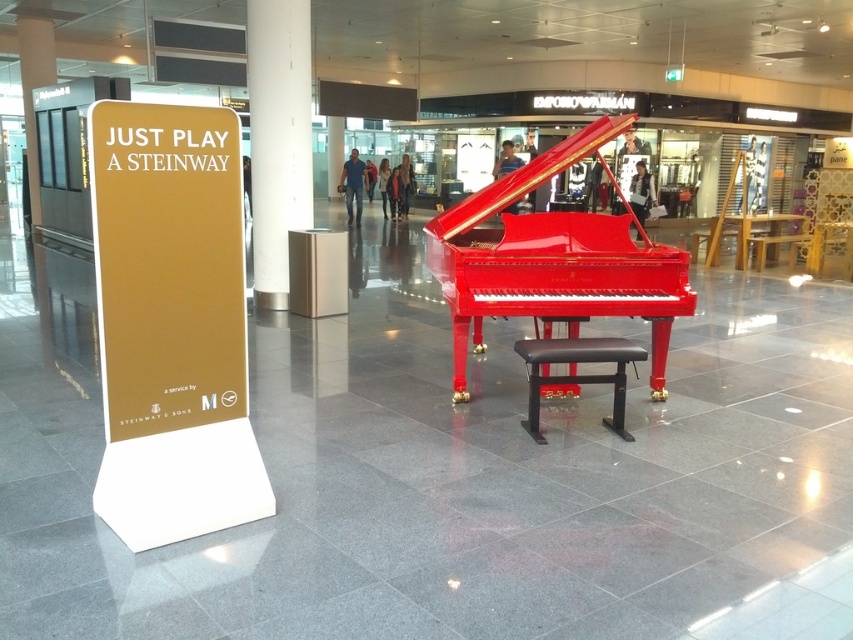
Does metallic gold pillar at upper left appear over metallic gray pillar at center?

No, metallic gold pillar at upper left is not above metallic gray pillar at center.

Does metallic gold pillar at upper left appear under metallic gray pillar at center?

Correct, metallic gold pillar at upper left is located below metallic gray pillar at center.

Who is more distant from viewer, (33, 160) or (334, 173)?

Positioned behind is point (334, 173).

Identify the location of metallic gold pillar at upper left. The width and height of the screenshot is (853, 640). (33, 88).

Can you confirm if white glossy pillar at center is positioned to the right of black leather stool at center?

In fact, white glossy pillar at center is to the left of black leather stool at center.

Describe the element at coordinates (277, 138) in the screenshot. This screenshot has height=640, width=853. I see `white glossy pillar at center` at that location.

Where is `white glossy pillar at center`? The height and width of the screenshot is (640, 853). white glossy pillar at center is located at coordinates (277, 138).

In the scene shown: Who is positioned more to the left, black leather stool at center or metallic gold pillar at upper left?

From the viewer's perspective, metallic gold pillar at upper left appears more on the left side.

Is point (546, 340) positioned before point (45, 58)?

Yes, point (546, 340) is closer to viewer.

Find the location of a particular element. This screenshot has width=853, height=640. black leather stool at center is located at coordinates (578, 376).